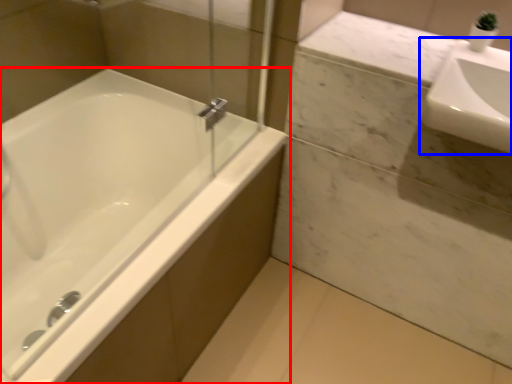
Question: Which object appears closest to the camera in this image, bathtub (highlighted by a red box) or sink (highlighted by a blue box)?

Choices:
 (A) bathtub
 (B) sink

Answer: (A)